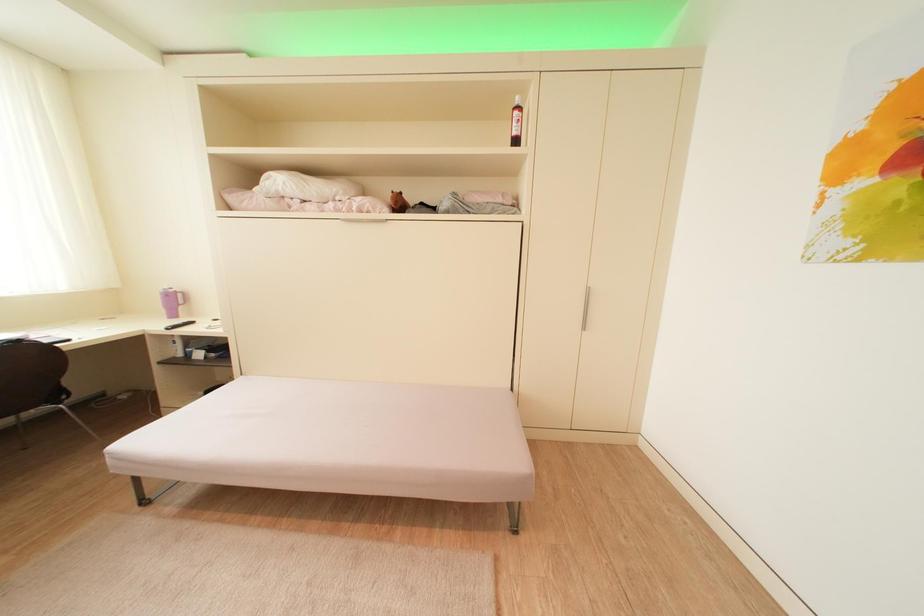
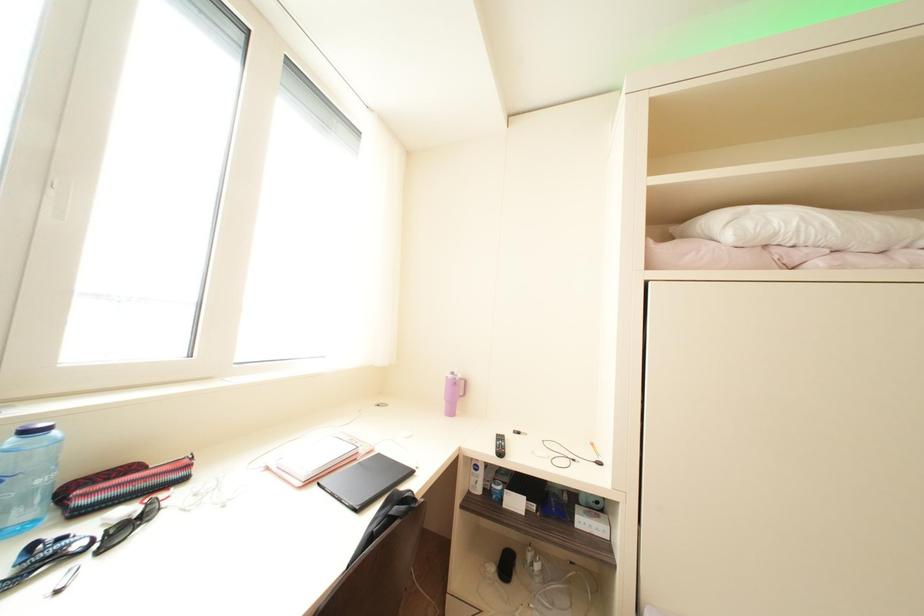
Question: Which direction would the cameraman need to move to produce the second image? Reply with the corresponding letter.

Choices:
 (A) Left
 (B) Right
 (C) Forward
 (D) Backward

Answer: (A)